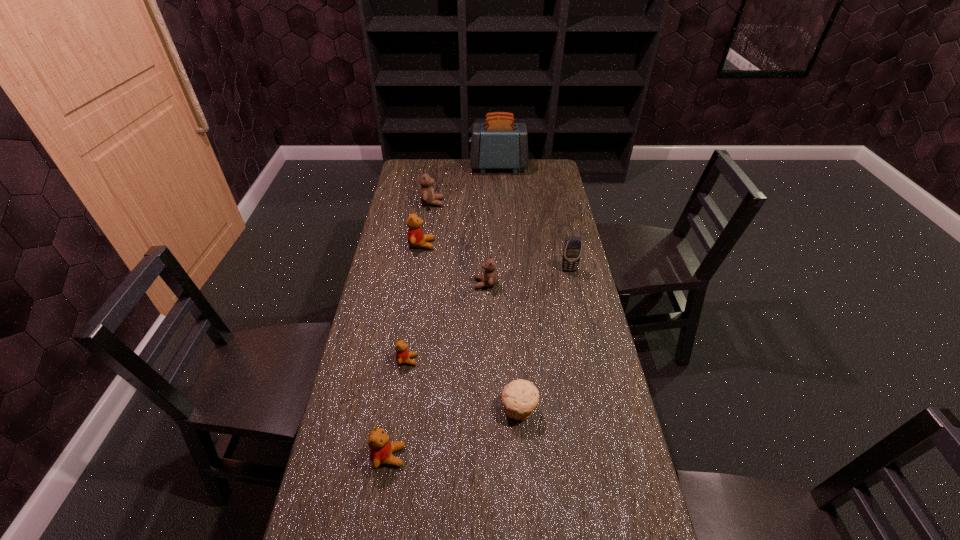
Identify the location of free location that satisfies the following two spatial constraints: 1. on the front face of the fourth farthest object; 2. on the front-facing side of the smallest red teddy bear. (588, 360).

At what (x,y) coordinates should I click in order to perform the action: click on vacant space that satisfies the following two spatial constraints: 1. on the front-facing side of the muffin; 2. on the left side of the nearer brown teddy bear. Please return your answer as a coordinate pair (x, y). Looking at the image, I should click on (487, 409).

The height and width of the screenshot is (540, 960). I want to click on blank space that satisfies the following two spatial constraints: 1. on the front face of the cellular telephone; 2. on the front-facing side of the fifth farthest object, so pyautogui.click(x=572, y=284).

The height and width of the screenshot is (540, 960). In order to click on vacant space that satisfies the following two spatial constraints: 1. on the front face of the fifth nearest object; 2. on the front-facing side of the third nearest object in this screenshot , I will do `click(588, 360)`.

Locate an element on the screen. The image size is (960, 540). vacant space that satisfies the following two spatial constraints: 1. on the front face of the cellular telephone; 2. on the front-facing side of the nearest red teddy bear is located at coordinates (610, 456).

The image size is (960, 540). What are the coordinates of `vacant space that satisfies the following two spatial constraints: 1. on the front face of the fifth nearest object; 2. on the front-facing side of the sixth farthest object` in the screenshot? It's located at (588, 360).